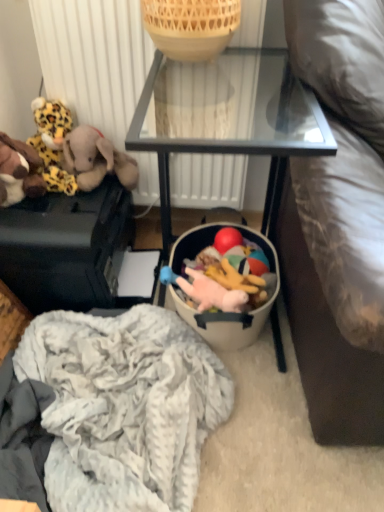
The width and height of the screenshot is (384, 512). What are the coordinates of `black glass table at center, which appears as the 1th furniture when viewed from the right` in the screenshot? It's located at (242, 125).

How much space does matte black suitcase at left, arranged as the 1th furniture when viewed from the left, occupy vertically?

12.73 inches.

In order to face pink plush toy at lower center, which appears as the 4th toy when viewed from the left, should I rotate leftwards or rightwards?

You should rotate right by 2.904 degrees.

The height and width of the screenshot is (512, 384). In order to click on bamboo basket at upper center in this screenshot , I will do `click(191, 26)`.

Describe the element at coordinates (191, 26) in the screenshot. This screenshot has width=384, height=512. I see `bamboo basket at upper center` at that location.

What is the approximate width of rubber ball at center, the 5th toy positioned from the left?

rubber ball at center, the 5th toy positioned from the left, is 3.65 inches in width.

At what (x,y) coordinates should I click in order to perform the action: click on brown plush toy at left, which ranks as the 5th toy in right-to-left order. Please return your answer as a coordinate pair (x, y). The height and width of the screenshot is (512, 384). Looking at the image, I should click on (18, 170).

Which is in front, point (97, 174) or point (97, 443)?

The point (97, 443) is closer to the camera.

Can white fluffy blanket at lower center be found inside brown plush elephant at left, the 3th toy from the left?

No, brown plush elephant at left, the 3th toy from the left, does not contain white fluffy blanket at lower center.

Which object is closer to the camera, brown plush elephant at left, acting as the third toy starting from the right, or white fluffy blanket at lower center?

white fluffy blanket at lower center is closer to the camera.

Considering the positions of point (227, 228) and point (221, 308), is point (227, 228) closer or farther from the camera than point (221, 308)?

Point (227, 228) appears to be farther away from the viewer than point (221, 308).

Which object is wider, rubber ball at center, acting as the first toy starting from the right, or pink plush toy at lower center, which appears as the 4th toy when viewed from the left?

pink plush toy at lower center, which appears as the 4th toy when viewed from the left.

Considering the sizes of objects rubber ball at center, the 5th toy positioned from the left, and pink plush toy at lower center, which appears as the 4th toy when viewed from the left, in the image provided, who is shorter, rubber ball at center, the 5th toy positioned from the left, or pink plush toy at lower center, which appears as the 4th toy when viewed from the left,?

rubber ball at center, the 5th toy positioned from the left.

Considering the sizes of rubber ball at center, acting as the first toy starting from the right, and pink plush toy at lower center, arranged as the second toy when viewed from the right, in the image, is rubber ball at center, acting as the first toy starting from the right, bigger or smaller than pink plush toy at lower center, arranged as the second toy when viewed from the right,?

Considering their sizes, rubber ball at center, acting as the first toy starting from the right, takes up less space than pink plush toy at lower center, arranged as the second toy when viewed from the right.

Can you confirm if brown plush elephant at left, the 3th toy from the left, is positioned to the left of leopard print plush at left, which ranks as the fourth toy in right-to-left order?

Incorrect, brown plush elephant at left, the 3th toy from the left, is not on the left side of leopard print plush at left, which ranks as the fourth toy in right-to-left order.

From their relative heights in the image, would you say brown plush elephant at left, the 3th toy from the left, is taller or shorter than leopard print plush at left, which ranks as the fourth toy in right-to-left order?

brown plush elephant at left, the 3th toy from the left, is taller than leopard print plush at left, which ranks as the fourth toy in right-to-left order.

How many degrees apart are the facing directions of brown plush elephant at left, acting as the third toy starting from the right, and leopard print plush at left, the second toy viewed from the left?

The angle between the facing direction of brown plush elephant at left, acting as the third toy starting from the right, and the facing direction of leopard print plush at left, the second toy viewed from the left, is 0.00179 degrees.

Is brown plush toy at left, positioned as the 1th toy in left-to-right order, positioned in front of white textured radiator at upper center?

Yes.

Consider the image. In the image, is brown plush toy at left, positioned as the 1th toy in left-to-right order, on the left side or the right side of white textured radiator at upper center?

brown plush toy at left, positioned as the 1th toy in left-to-right order, is to the left of white textured radiator at upper center.

How different are the orientations of leopard print plush at left, which ranks as the fourth toy in right-to-left order, and bamboo basket at upper center in degrees?

The facing directions of leopard print plush at left, which ranks as the fourth toy in right-to-left order, and bamboo basket at upper center are 1.17 degrees apart.

Is leopard print plush at left, the second toy viewed from the left, to the left of bamboo basket at upper center from the viewer's perspective?

Indeed, leopard print plush at left, the second toy viewed from the left, is positioned on the left side of bamboo basket at upper center.

From the picture: Is leopard print plush at left, which ranks as the fourth toy in right-to-left order, further to the viewer compared to bamboo basket at upper center?

Yes, leopard print plush at left, which ranks as the fourth toy in right-to-left order, is behind bamboo basket at upper center.

Is leopard print plush at left, the second toy viewed from the left, shorter than bamboo basket at upper center?

No.

Considering the sizes of black glass table at center, which appears as the 1th furniture when viewed from the right, and rubber ball at center, the 5th toy positioned from the left, in the image, is black glass table at center, which appears as the 1th furniture when viewed from the right, wider or thinner than rubber ball at center, the 5th toy positioned from the left,?

Clearly, black glass table at center, which appears as the 1th furniture when viewed from the right, has more width compared to rubber ball at center, the 5th toy positioned from the left.

Starting from the rubber ball at center, acting as the first toy starting from the right, which furniture is the 1st one to the left? Please provide its 2D coordinates.

[(242, 125)]

Is rubber ball at center, the 5th toy positioned from the left, inside black glass table at center, which appears as the 1th furniture when viewed from the right?

Yes.

Is point (202, 68) closer to viewer compared to point (231, 234)?

That is True.

Is black glass table at center, which is the second furniture in left-to-right order, facing towards white fluffy blanket at lower center?

Yes, black glass table at center, which is the second furniture in left-to-right order, is aimed at white fluffy blanket at lower center.

Is black glass table at center, which is the second furniture in left-to-right order, next to white fluffy blanket at lower center and touching it?

black glass table at center, which is the second furniture in left-to-right order, and white fluffy blanket at lower center are not in contact.

The height and width of the screenshot is (512, 384). I want to click on clothing on the left of black glass table at center, which appears as the 1th furniture when viewed from the right, so click(x=124, y=407).

From a real-world perspective, which toy is the 3rd one above the white fluffy blanket at lower center? Please provide its 2D coordinates.

[(96, 159)]

Identify the location of toy below the pink plush toy at lower center, which appears as the 4th toy when viewed from the left (from a real-world perspective). (227, 239).

From the image, which object appears to be nearer to leopard print plush at left, the second toy viewed from the left, pink plush toy at lower center, which appears as the 4th toy when viewed from the left, or brown plush elephant at left, the 3th toy from the left?

Among the two, brown plush elephant at left, the 3th toy from the left, is located nearer to leopard print plush at left, the second toy viewed from the left.

When comparing their distances from matte black suitcase at left, the second furniture positioned from the right, does pink plush toy at lower center, arranged as the second toy when viewed from the right, or leopard print plush at left, which ranks as the fourth toy in right-to-left order, seem further?

pink plush toy at lower center, arranged as the second toy when viewed from the right, is further to matte black suitcase at left, the second furniture positioned from the right.

Based on their spatial positions, is white textured radiator at upper center or black glass table at center, which appears as the 1th furniture when viewed from the right, closer to white fluffy blanket at lower center?

black glass table at center, which appears as the 1th furniture when viewed from the right.

When comparing their distances from bamboo basket at upper center, does brown plush toy at left, positioned as the 1th toy in left-to-right order, or black glass table at center, which is the second furniture in left-to-right order, seem closer?

Among the two, black glass table at center, which is the second furniture in left-to-right order, is located nearer to bamboo basket at upper center.

Which object lies nearer to the anchor point pink plush toy at lower center, which appears as the 4th toy when viewed from the left, matte black suitcase at left, the second furniture positioned from the right, or brown plush elephant at left, the 3th toy from the left?

Based on the image, matte black suitcase at left, the second furniture positioned from the right, appears to be nearer to pink plush toy at lower center, which appears as the 4th toy when viewed from the left.

Estimate the real-world distances between objects in this image. Which object is further from pink plush toy at lower center, which appears as the 4th toy when viewed from the left, black glass table at center, which is the second furniture in left-to-right order, or white textured radiator at upper center?

The object further to pink plush toy at lower center, which appears as the 4th toy when viewed from the left, is white textured radiator at upper center.

From the image, which object appears to be farther from matte black suitcase at left, the second furniture positioned from the right, leopard print plush at left, which ranks as the fourth toy in right-to-left order, or rubber ball at center, the 5th toy positioned from the left?

rubber ball at center, the 5th toy positioned from the left, is further to matte black suitcase at left, the second furniture positioned from the right.

Based on their spatial positions, is brown plush elephant at left, the 3th toy from the left, or white fluffy blanket at lower center further from brown plush toy at left, which ranks as the 5th toy in right-to-left order?

Among the two, white fluffy blanket at lower center is located further to brown plush toy at left, which ranks as the 5th toy in right-to-left order.

At what (x,y) coordinates should I click in order to perform the action: click on furniture that lies between white textured radiator at upper center and matte black suitcase at left, the second furniture positioned from the right, from top to bottom. Please return your answer as a coordinate pair (x, y). Looking at the image, I should click on (242, 125).

Locate an element on the screen. furniture positioned between black glass table at center, which is the second furniture in left-to-right order, and brown plush elephant at left, acting as the third toy starting from the right, from near to far is located at coordinates (64, 247).

At what (x,y) coordinates should I click in order to perform the action: click on furniture located between black glass table at center, which appears as the 1th furniture when viewed from the right, and rubber ball at center, the 5th toy positioned from the left, in the depth direction. Please return your answer as a coordinate pair (x, y). This screenshot has width=384, height=512. Looking at the image, I should click on (64, 247).

Where is `furniture between bamboo basket at upper center and matte black suitcase at left, arranged as the 1th furniture when viewed from the left, from top to bottom`? furniture between bamboo basket at upper center and matte black suitcase at left, arranged as the 1th furniture when viewed from the left, from top to bottom is located at coordinates click(242, 125).